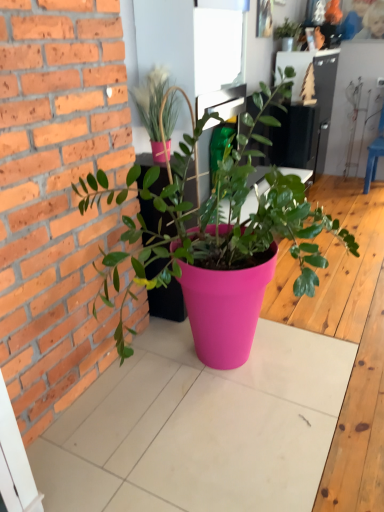
Question: In terms of width, does pink plastic pot at center, acting as the 3th houseplant starting from the top, look wider or thinner when compared to matte green plant at upper center, which ranks as the first houseplant in back-to-front order?

Choices:
 (A) wide
 (B) thin

Answer: (A)

Question: Does point (352, 245) appear closer or farther from the camera than point (274, 34)?

Choices:
 (A) closer
 (B) farther

Answer: (A)

Question: Considering the real-world distances, which object is closest to the matte pink pot at upper center, arranged as the second houseplant when viewed from the top?

Choices:
 (A) blue plastic chair at right
 (B) pink plastic pot at center, acting as the 3th houseplant starting from the top
 (C) matte green plant at upper center, the 3th houseplant viewed from the front

Answer: (B)

Question: Which object is the closest to the matte pink pot at upper center, which is the 2th houseplant from back to front?

Choices:
 (A) blue plastic chair at right
 (B) matte green plant at upper center, the 3th houseplant viewed from the front
 (C) pink plastic pot at center, acting as the 3th houseplant starting from the top

Answer: (C)